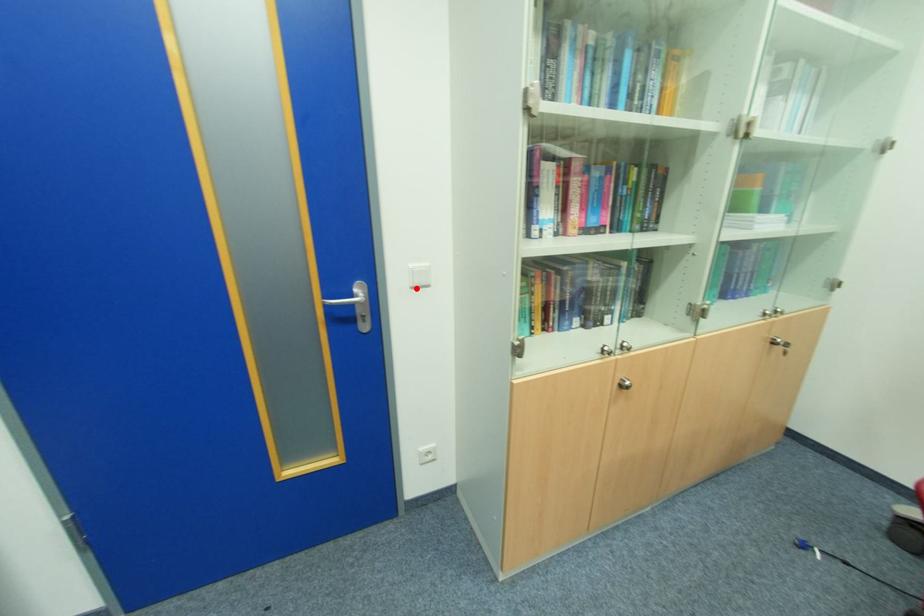
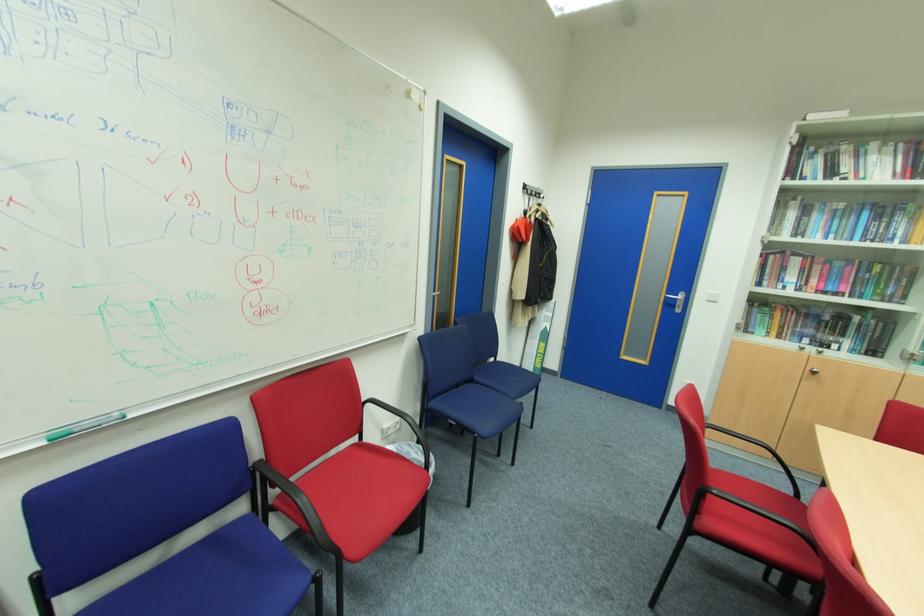
Where in the second image is the point corresponding to the highlighted location from the first image?

(711, 301)